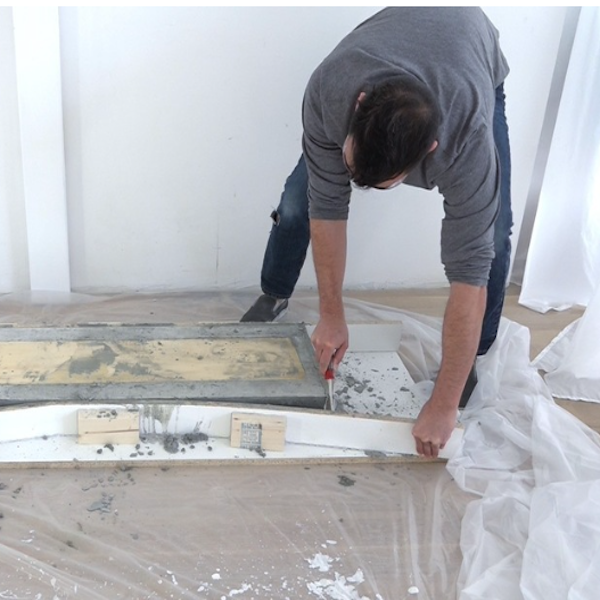
I want to click on wall, so click(245, 121).